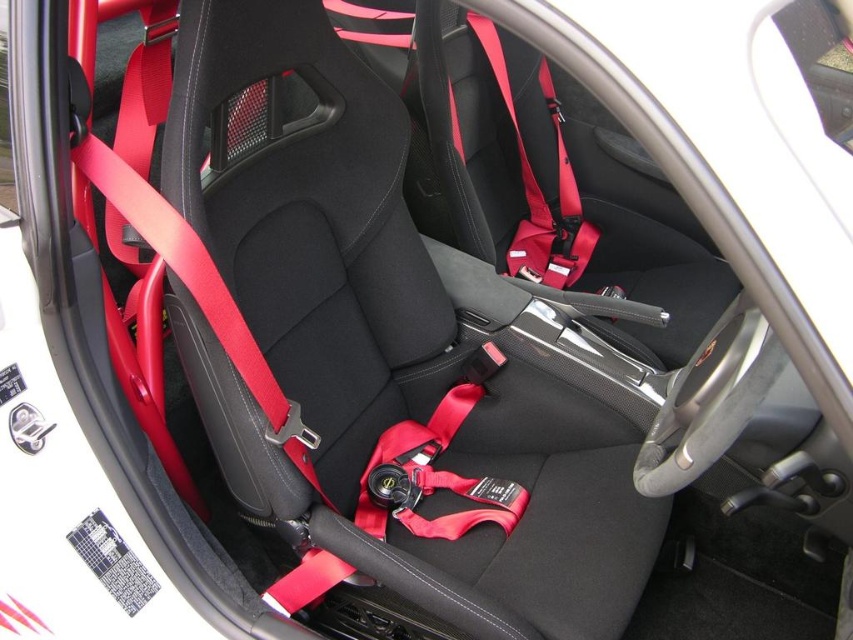
Question: Is matte red seatbelt at center thinner than matte red seatbelt at upper right?

Choices:
 (A) no
 (B) yes

Answer: (A)

Question: Where is matte red seatbelt at center located in relation to matte red seatbelt at upper right in the image?

Choices:
 (A) left
 (B) right

Answer: (A)

Question: Which point is farther to the camera?

Choices:
 (A) matte red seatbelt at upper right
 (B) matte red seatbelt at center

Answer: (A)

Question: Which of the following is the farthest from the observer?

Choices:
 (A) (596, 241)
 (B) (485, 481)

Answer: (A)

Question: Does matte red seatbelt at center appear over matte red seatbelt at upper right?

Choices:
 (A) yes
 (B) no

Answer: (B)